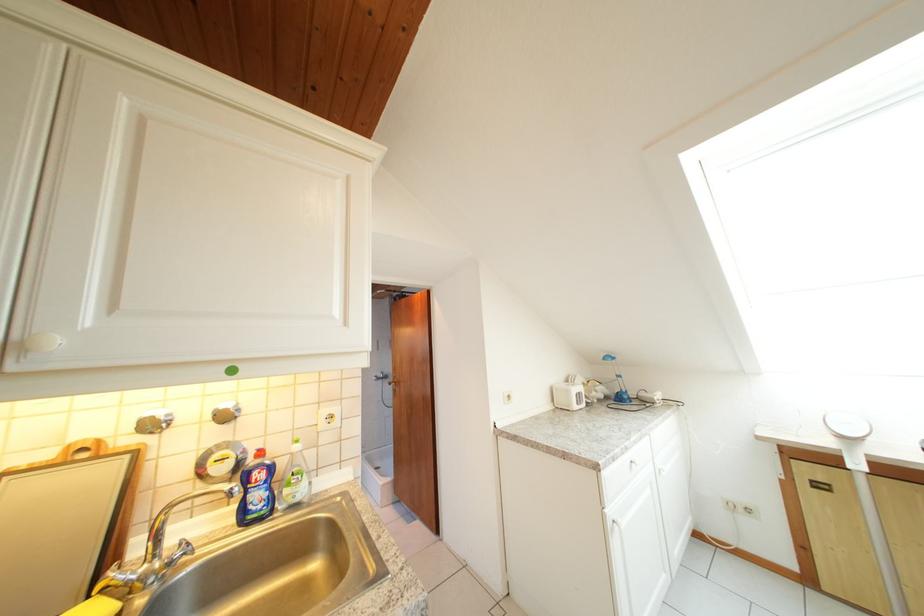
The width and height of the screenshot is (924, 616). Identify the location of faucet handle. (167, 560).